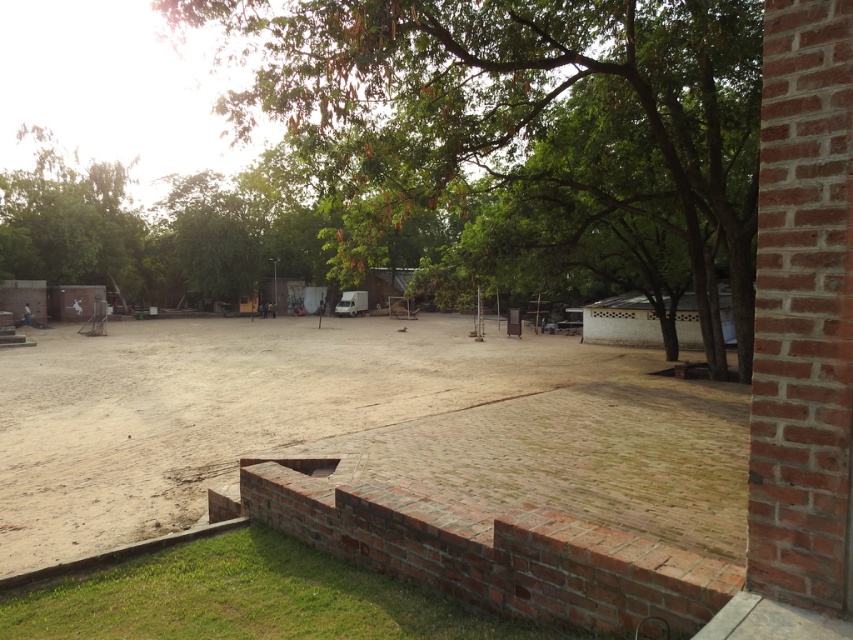
Between point (195, 24) and point (167, 396), which one is positioned behind?

The point (167, 396) is more distant.

This screenshot has width=853, height=640. What do you see at coordinates (523, 120) in the screenshot?
I see `green leafy tree at center` at bounding box center [523, 120].

The height and width of the screenshot is (640, 853). In order to click on green leafy tree at center in this screenshot , I will do pyautogui.click(x=523, y=120).